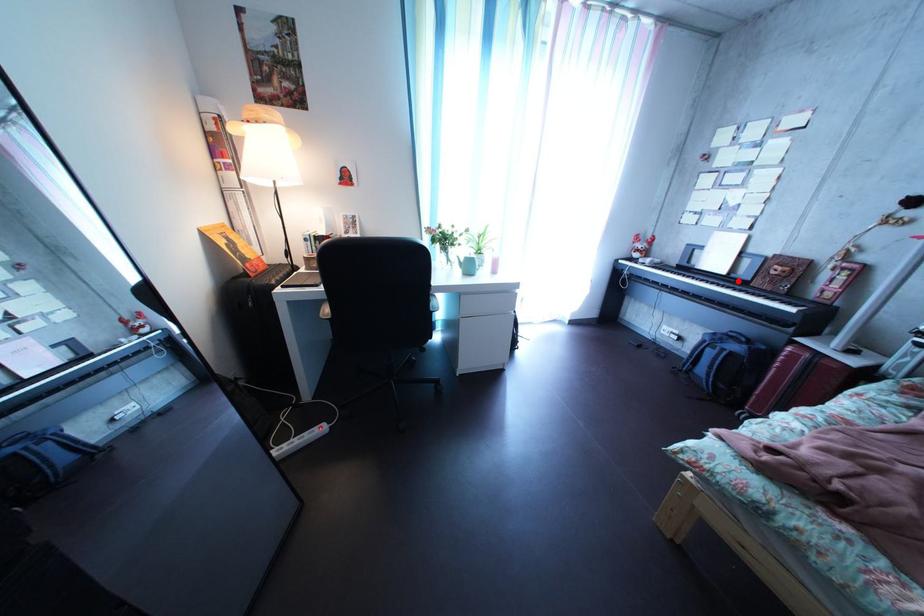
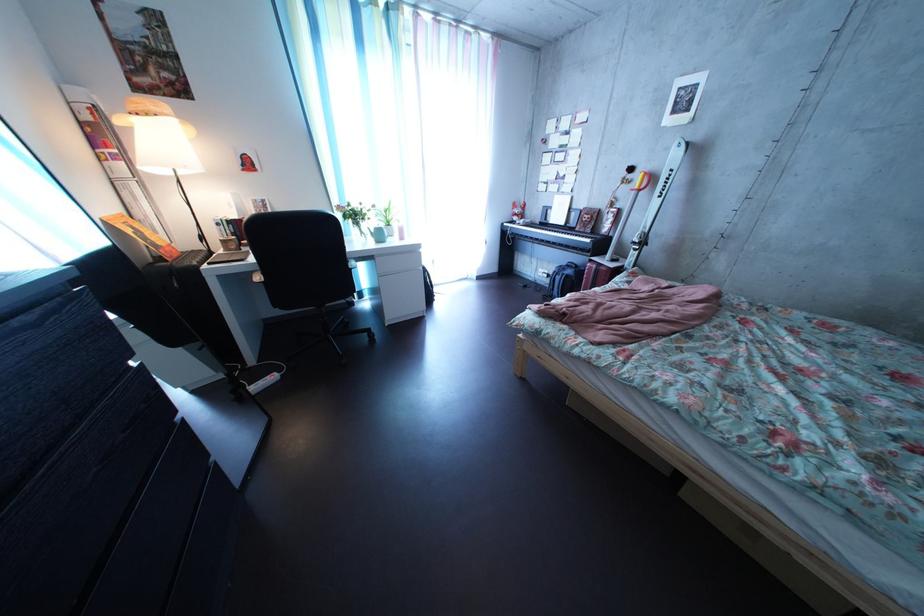
Where in the second image is the point corresponding to the highlighted location from the first image?

(577, 232)